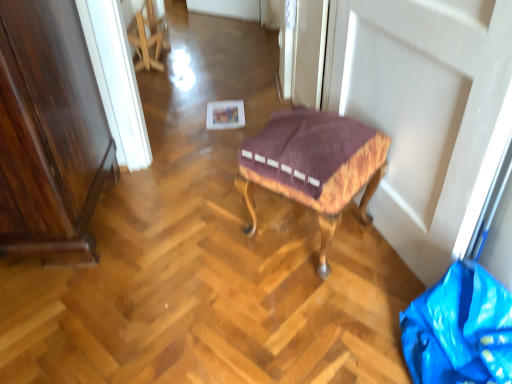
Question: Does point (328, 163) appear closer or farther from the camera than point (407, 354)?

Choices:
 (A) closer
 (B) farther

Answer: (B)

Question: Looking at the image, does velvet upholstered stool at center seem bigger or smaller compared to blue plastic bag at lower right?

Choices:
 (A) big
 (B) small

Answer: (A)

Question: From the image's perspective, relative to blue plastic bag at lower right, is velvet upholstered stool at center above or below?

Choices:
 (A) below
 (B) above

Answer: (B)

Question: Considering the positions of blue plastic bag at lower right and velvet upholstered stool at center in the image, is blue plastic bag at lower right taller or shorter than velvet upholstered stool at center?

Choices:
 (A) tall
 (B) short

Answer: (B)

Question: From a real-world perspective, is blue plastic bag at lower right positioned above or below velvet upholstered stool at center?

Choices:
 (A) below
 (B) above

Answer: (A)

Question: Relative to velvet upholstered stool at center, is blue plastic bag at lower right in front or behind?

Choices:
 (A) behind
 (B) front

Answer: (B)

Question: In terms of size, does blue plastic bag at lower right appear bigger or smaller than velvet upholstered stool at center?

Choices:
 (A) big
 (B) small

Answer: (B)